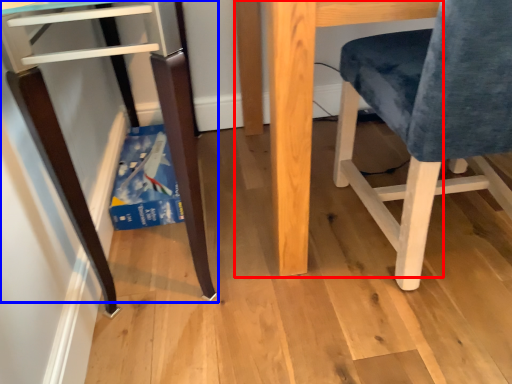
Question: Among these objects, which one is nearest to the camera, table (highlighted by a red box) or furniture (highlighted by a blue box)?

Choices:
 (A) table
 (B) furniture

Answer: (B)